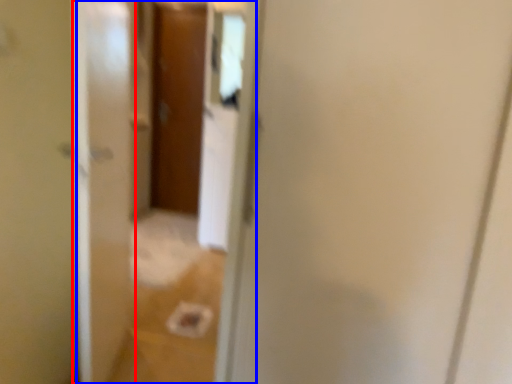
Question: Among these objects, which one is nearest to the camera, screen door (highlighted by a red box) or glass door (highlighted by a blue box)?

Choices:
 (A) screen door
 (B) glass door

Answer: (A)